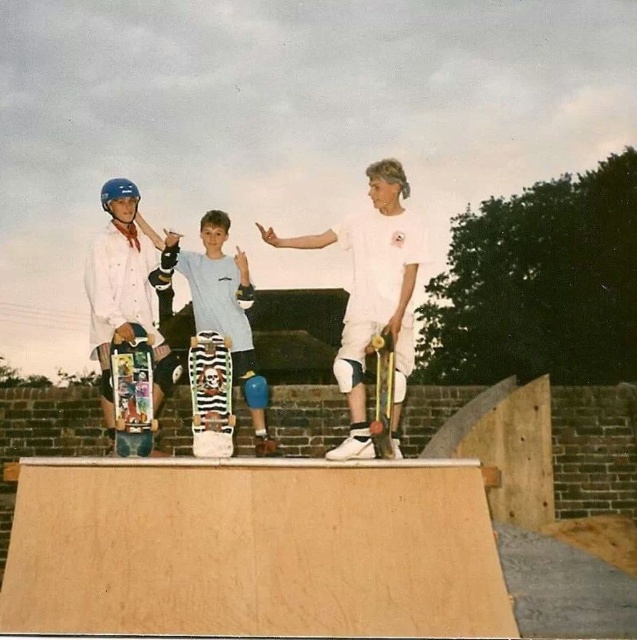
Does point (392, 192) come farther from viewer compared to point (131, 324)?

That is True.

Based on the photo, measure the distance between white matte skateboard at center and multicolored graphic skateboard at center.

The distance of white matte skateboard at center from multicolored graphic skateboard at center is 7.28 meters.

The width and height of the screenshot is (637, 640). Identify the location of white matte skateboard at center. (373, 296).

Identify the location of white matte skateboard at center. (373, 296).

Locate an element on the screen. Image resolution: width=637 pixels, height=640 pixels. matte black skateboard at center is located at coordinates (124, 296).

The height and width of the screenshot is (640, 637). What do you see at coordinates (124, 296) in the screenshot?
I see `matte black skateboard at center` at bounding box center [124, 296].

Locate an element on the screen. This screenshot has width=637, height=640. matte black skateboard at center is located at coordinates (124, 296).

Looking at this image, does matte black skateboard at center appear over multicolored graphic skateboard at center?

Correct, matte black skateboard at center is located above multicolored graphic skateboard at center.

Looking at this image, between matte black skateboard at center and multicolored graphic skateboard at center, which one appears on the right side from the viewer's perspective?

multicolored graphic skateboard at center

Does point (124, 188) come farther from viewer compared to point (148, 419)?

Yes.

Where is `matte black skateboard at center`? The height and width of the screenshot is (640, 637). matte black skateboard at center is located at coordinates (124, 296).